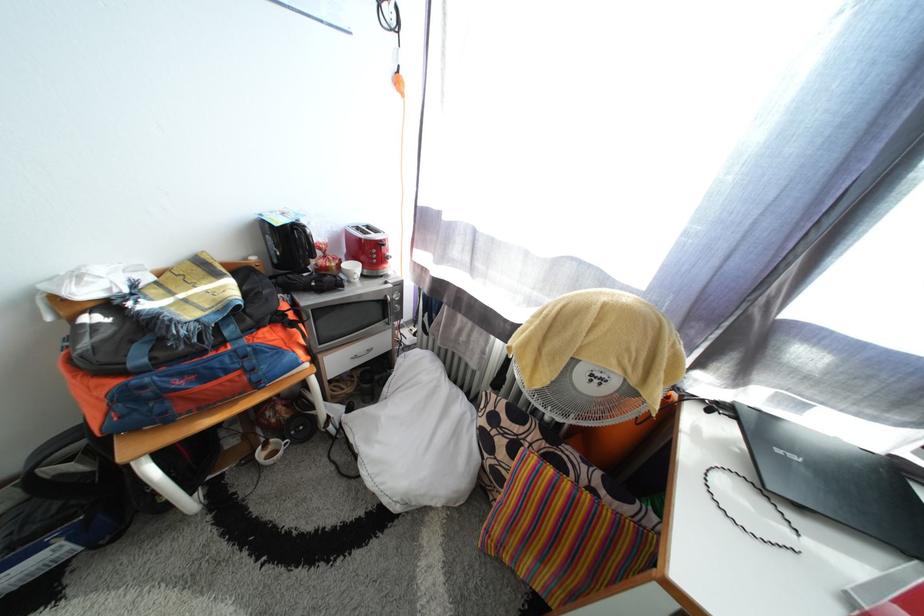
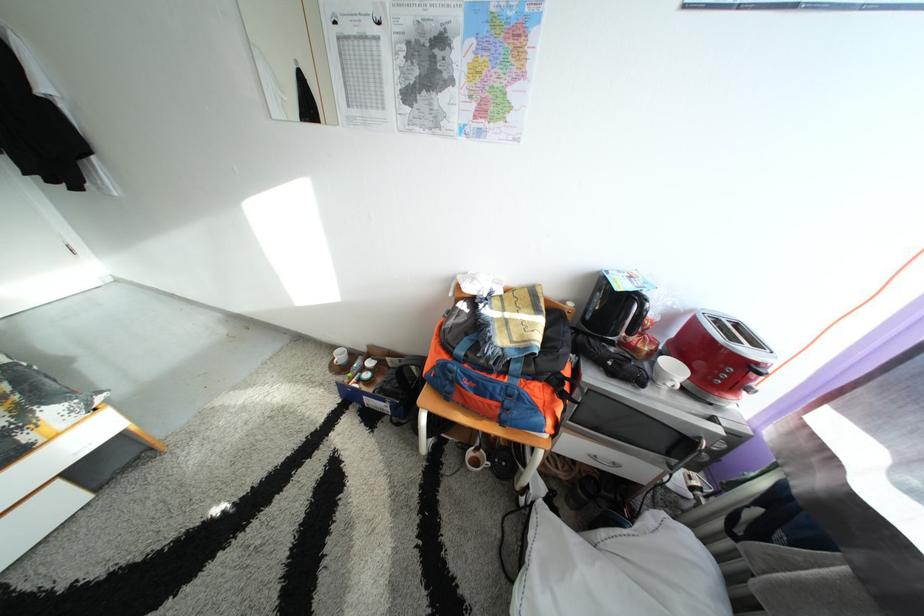
The point at [280,455] is marked in the first image. Where is the corresponding point in the second image?

(487, 461)